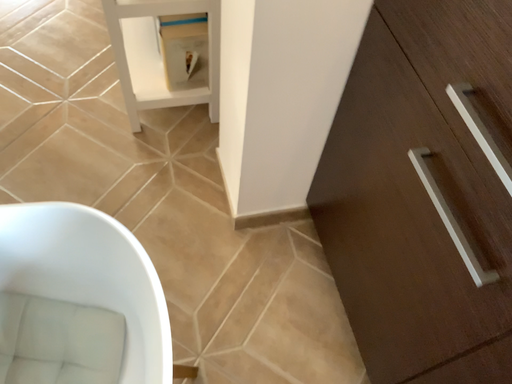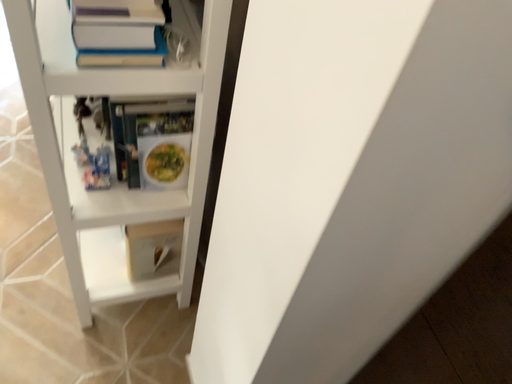
Question: How did the camera likely rotate when shooting the video?

Choices:
 (A) rotated right
 (B) rotated left

Answer: (A)